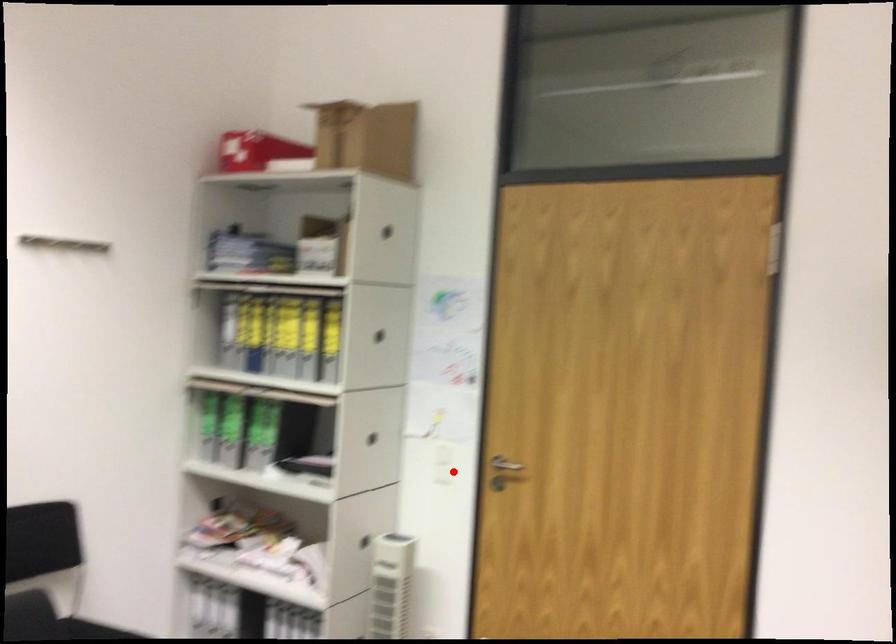
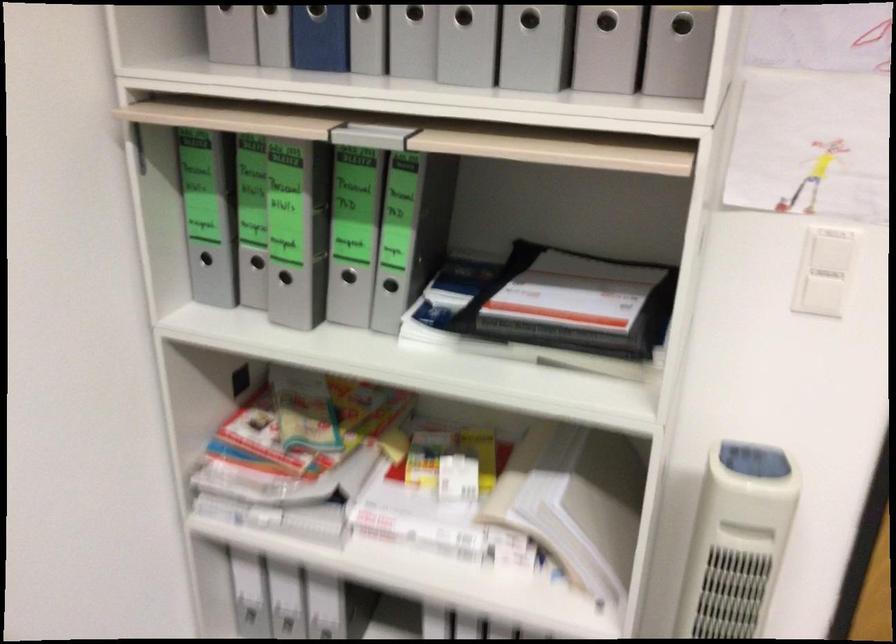
Question: A red point is marked in image1. In image2, is the corresponding 3D point closer to the camera or farther? Reply with the corresponding letter.

Choices:
 (A) The corresponding 3D point is closer.
 (B) The corresponding 3D point is farther.

Answer: (A)